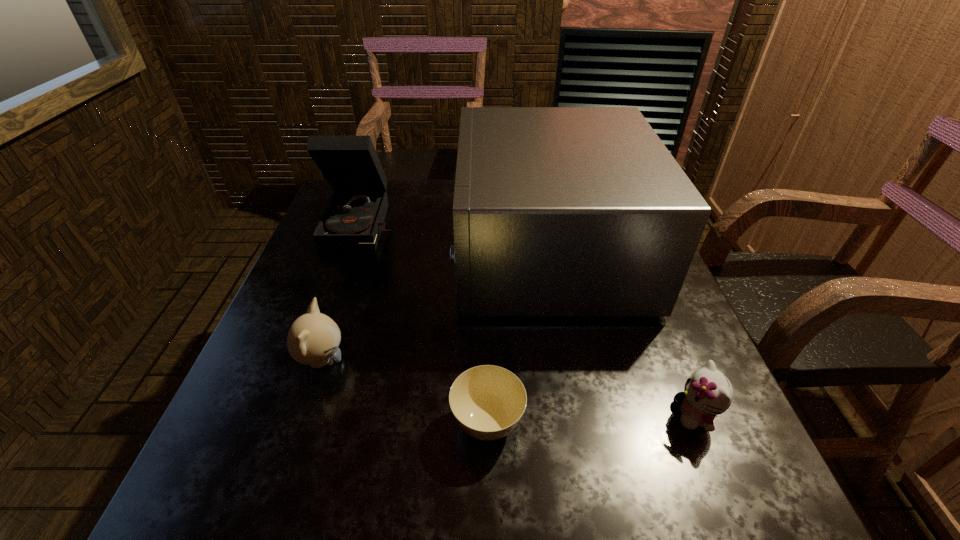
The height and width of the screenshot is (540, 960). Identify the location of vacant region that satisfies the following two spatial constraints: 1. on the face of the shortest object; 2. on the right side of the farther kitten. (300, 423).

At what (x,y) coordinates should I click in order to perform the action: click on vacant space that satisfies the following two spatial constraints: 1. on the face of the left kitten; 2. on the right side of the shortest object. Please return your answer as a coordinate pair (x, y). Image resolution: width=960 pixels, height=540 pixels. Looking at the image, I should click on 300,423.